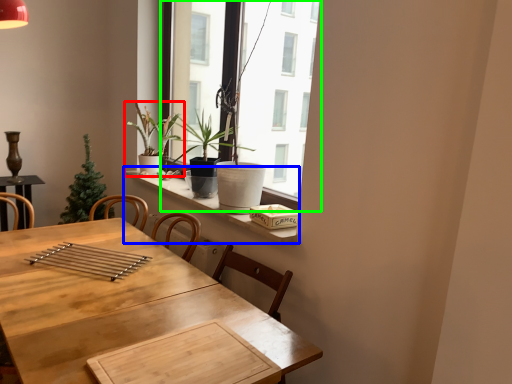
Question: Which object is the closest to the houseplant (highlighted by a red box)? Choose among these: window sill (highlighted by a blue box) or window (highlighted by a green box).

Choices:
 (A) window sill
 (B) window

Answer: (A)